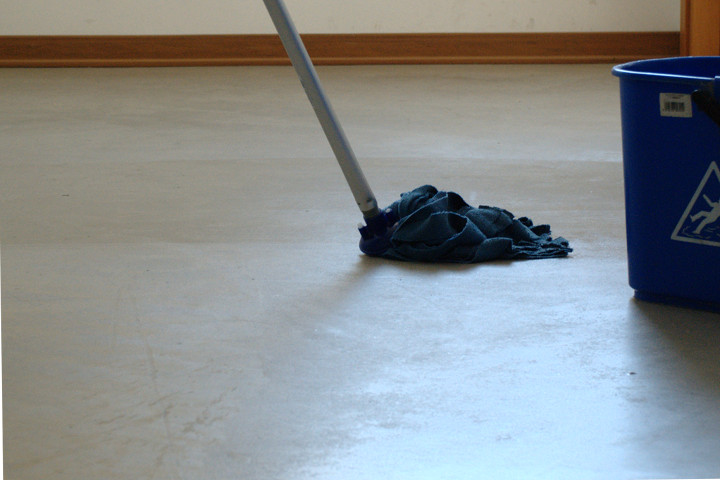
At what (x,y) coordinates should I click in order to perform the action: click on white wall. Please return your answer as a coordinate pair (x, y). This screenshot has width=720, height=480. Looking at the image, I should click on (153, 27).